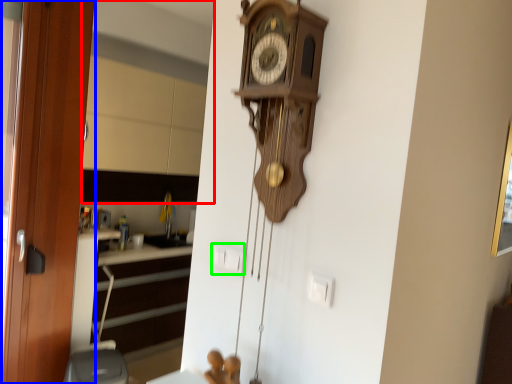
Question: Which object is positioned closest to mirror (highlighted by a red box)? Select from door (highlighted by a blue box) and electric outlet (highlighted by a green box).

Choices:
 (A) door
 (B) electric outlet

Answer: (A)